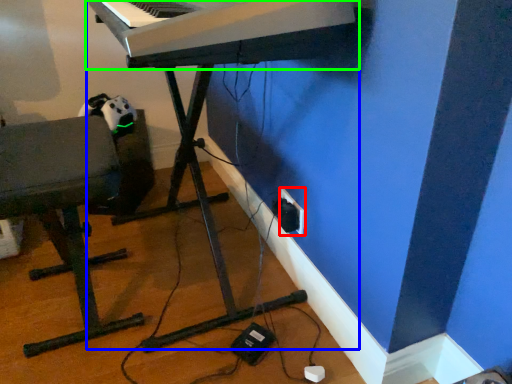
Question: Based on their relative distances, which object is nearer to electric outlet (highlighted by a red box)? Choose from piano (highlighted by a blue box) and musical keyboard (highlighted by a green box).

Choices:
 (A) piano
 (B) musical keyboard

Answer: (A)